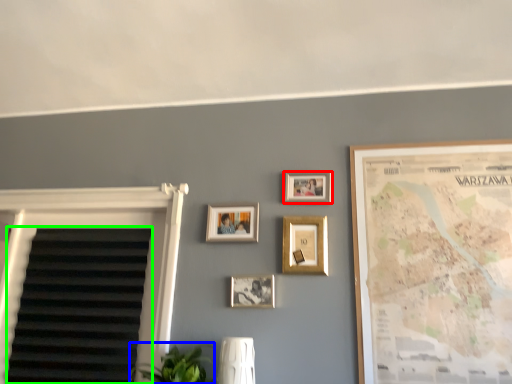
Question: Which is nearer to the picture frame (highlighted by a red box)? plant (highlighted by a blue box) or blind (highlighted by a green box).

Choices:
 (A) plant
 (B) blind

Answer: (A)